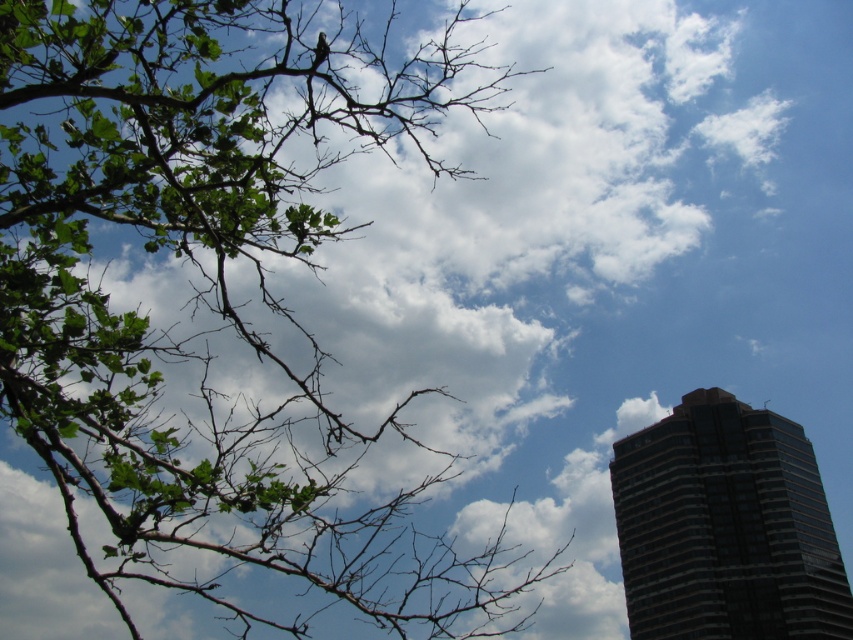
You are an urban planner analyzing the image. You need to determine which object has a narrower width between the green leafy branches at upper left and the dark glass building at right. Which one is narrower?

The green leafy branches at upper left is thinner than the dark glass building at right, so the green leafy branches at upper left has a narrower width.

You are an urban planner assessing the impact of greenery on city aesthetics. You observe the green leafy branches at upper left and the dark glass building at right in the scene. Which object occupies a more prominent visual space in the image?

The green leafy branches at upper left occupies a more prominent visual space in the image as it has a larger size compared to the dark glass building at right.